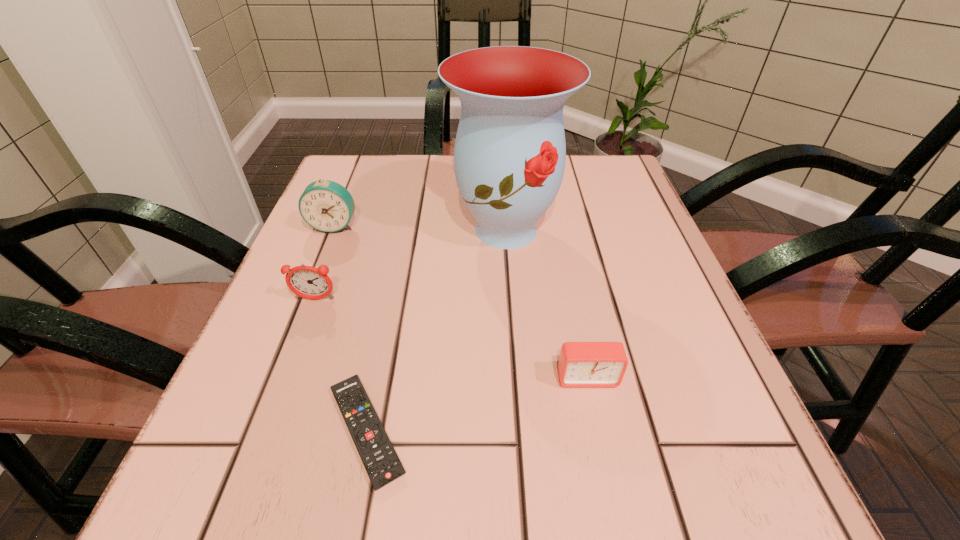
Image resolution: width=960 pixels, height=540 pixels. In the image, there is a desktop. Identify the location of vacant space at the left edge. (254, 407).

Where is `free space at the right edge of the desktop`? free space at the right edge of the desktop is located at coordinates (598, 268).

In the image, there is a desktop. At what (x,y) coordinates should I click in order to perform the action: click on free region at the far left corner. Please return your answer as a coordinate pair (x, y). This screenshot has width=960, height=540. Looking at the image, I should click on (383, 173).

Where is `free space at the near left corner`? This screenshot has height=540, width=960. free space at the near left corner is located at coordinates pos(273,478).

Find the location of a particular element. The width and height of the screenshot is (960, 540). vacant area at the far right corner of the desktop is located at coordinates (594, 165).

You are a GUI agent. You are given a task and a screenshot of the screen. Output one action in this format:
    pyautogui.click(x=<x>, y=<y>)
    Task: Click on the free region at the near right corner of the desktop
    The image size is (960, 540).
    Given the screenshot: What is the action you would take?
    pyautogui.click(x=696, y=497)

The image size is (960, 540). Find the location of `unoccupied position between the second tallest alarm clock and the shortest alarm clock`. unoccupied position between the second tallest alarm clock and the shortest alarm clock is located at coordinates (451, 339).

Image resolution: width=960 pixels, height=540 pixels. Find the location of `free spot between the fourth tallest object and the third farthest object`. free spot between the fourth tallest object and the third farthest object is located at coordinates (451, 339).

Identify the location of vacant area that lies between the second tallest object and the shortest alarm clock. Image resolution: width=960 pixels, height=540 pixels. (461, 301).

Where is `free point between the third shortest object and the remote control`? The image size is (960, 540). free point between the third shortest object and the remote control is located at coordinates (341, 365).